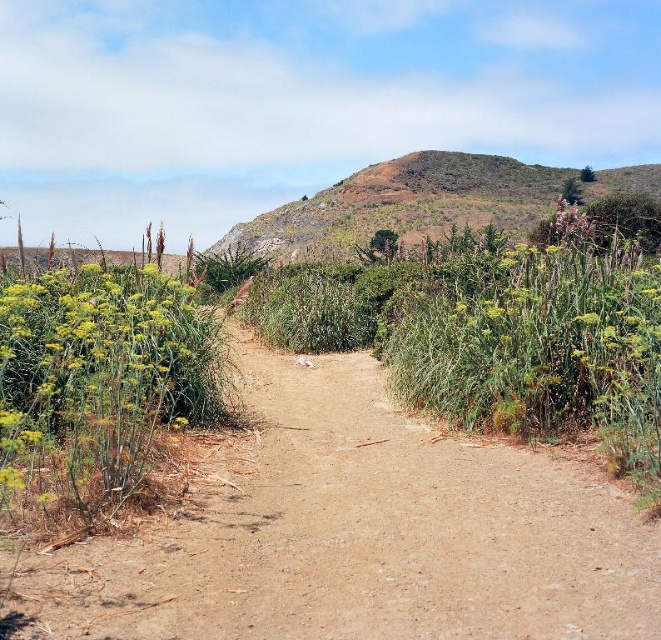
Question: Among these objects, which one is nearest to the camera?

Choices:
 (A) brown dirt track at center
 (B) green leafy plant at left

Answer: (A)

Question: Can you confirm if green leafy plant at left is positioned to the right of green grassy hillside at upper center?

Choices:
 (A) no
 (B) yes

Answer: (A)

Question: Where is green leafy plant at left located in relation to green grassy hillside at upper center in the image?

Choices:
 (A) left
 (B) right

Answer: (A)

Question: Among these points, which one is farthest from the camera?

Choices:
 (A) (496, 637)
 (B) (410, 211)
 (C) (79, 273)

Answer: (B)

Question: Is brown dirt track at center smaller than green grassy hillside at upper center?

Choices:
 (A) yes
 (B) no

Answer: (A)

Question: Which point is closer to the camera taking this photo?

Choices:
 (A) (531, 182)
 (B) (329, 586)

Answer: (B)